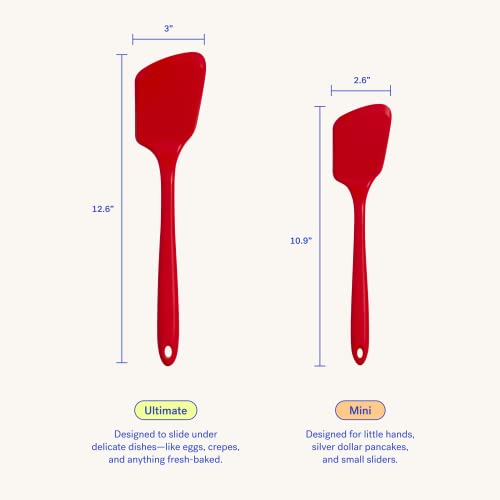
I want to click on handles, so click(x=356, y=275), click(x=159, y=300).